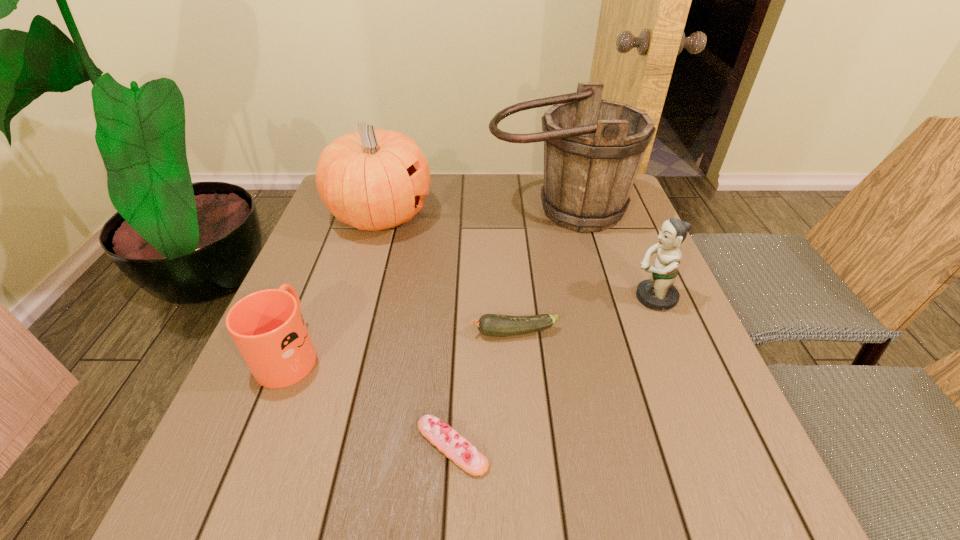
Where is `vacant space positioned 0.130m on the front-facing side of the fourth shortest object`? This screenshot has height=540, width=960. vacant space positioned 0.130m on the front-facing side of the fourth shortest object is located at coordinates (573, 298).

Locate an element on the screen. The image size is (960, 540). free space located on the front-facing side of the fourth shortest object is located at coordinates (590, 298).

You are a GUI agent. You are given a task and a screenshot of the screen. Output one action in this format:
    pyautogui.click(x=<x>, y=<y>)
    Task: Click on the vacant position located on the front-facing side of the fourth shortest object
    
    Given the screenshot: What is the action you would take?
    pyautogui.click(x=481, y=298)

The height and width of the screenshot is (540, 960). What are the coordinates of `blank space located 0.320m on the handle side of the mug` in the screenshot? It's located at pos(338,233).

You are a GUI agent. You are given a task and a screenshot of the screen. Output one action in this format:
    pyautogui.click(x=<x>, y=<y>)
    Task: Click on the free space located 0.080m on the handle side of the mug
    The height and width of the screenshot is (540, 960).
    Given the screenshot: What is the action you would take?
    point(313,295)

Locate an element on the screen. Image resolution: width=960 pixels, height=540 pixels. vacant area situated on the handle side of the mug is located at coordinates (309, 304).

Where is `vacant region located 0.180m at the blossom end of the second shortest object`? vacant region located 0.180m at the blossom end of the second shortest object is located at coordinates (385, 333).

This screenshot has width=960, height=540. I want to click on free space located at the blossom end of the second shortest object, so click(300, 333).

This screenshot has width=960, height=540. Identify the location of vacant space located 0.100m at the blossom end of the second shortest object. (423, 333).

I want to click on vacant space located on the left of the shortest object, so click(x=380, y=446).